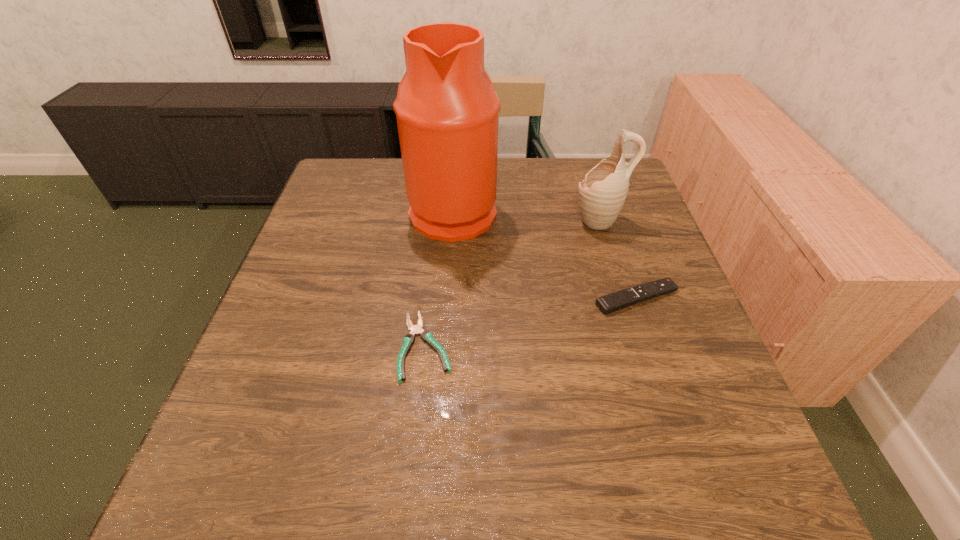
At what (x,y) coordinates should I click in order to perform the action: click on vacant region between the remote control and the shortest object. Please return your answer as a coordinate pair (x, y). This screenshot has width=960, height=540. Looking at the image, I should click on (532, 322).

At what (x,y) coordinates should I click in order to perform the action: click on free spot between the pliers and the remote control. Please return your answer as a coordinate pair (x, y). The width and height of the screenshot is (960, 540). Looking at the image, I should click on (532, 322).

This screenshot has height=540, width=960. In order to click on empty location between the third shortest object and the water jug in this screenshot , I will do `click(526, 215)`.

The height and width of the screenshot is (540, 960). I want to click on vacant region between the third shortest object and the remote control, so click(618, 259).

This screenshot has width=960, height=540. I want to click on free spot between the pliers and the remote control, so click(532, 322).

Identify the location of vacant space that is in between the water jug and the second shortest object. The image size is (960, 540). (545, 254).

Locate an element on the screen. free space between the water jug and the remote control is located at coordinates (545, 254).

The height and width of the screenshot is (540, 960). Find the location of `empty space that is in between the pliers and the remote control`. empty space that is in between the pliers and the remote control is located at coordinates (532, 322).

The height and width of the screenshot is (540, 960). Identify the location of vacant space that is in between the water jug and the pitcher. (526, 215).

Identify which object is the second nearest to the tallest object. Please provide its 2D coordinates. Your answer should be formatted as a tuple, i.e. [(x, y)], where the tuple contains the x and y coordinates of a point satisfying the conditions above.

[(427, 336)]